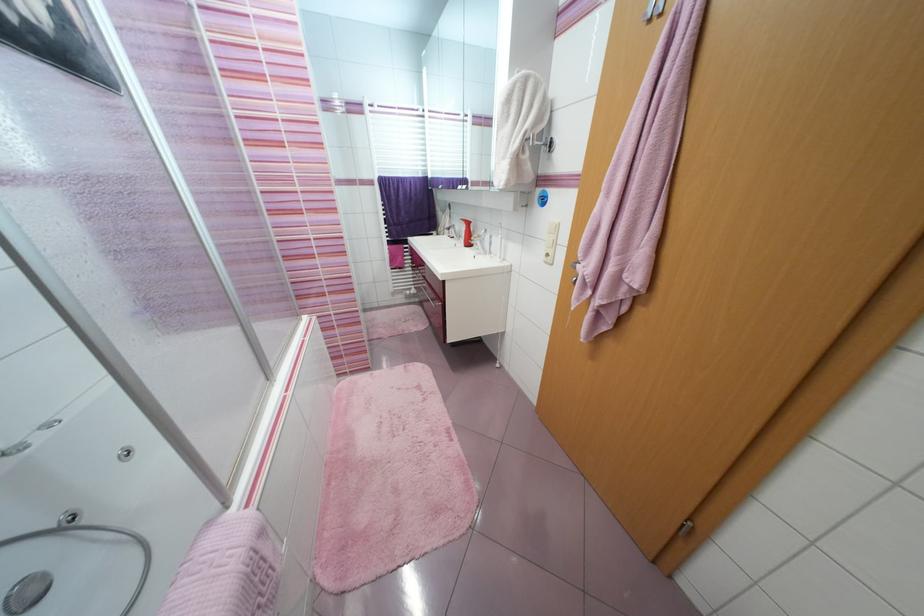
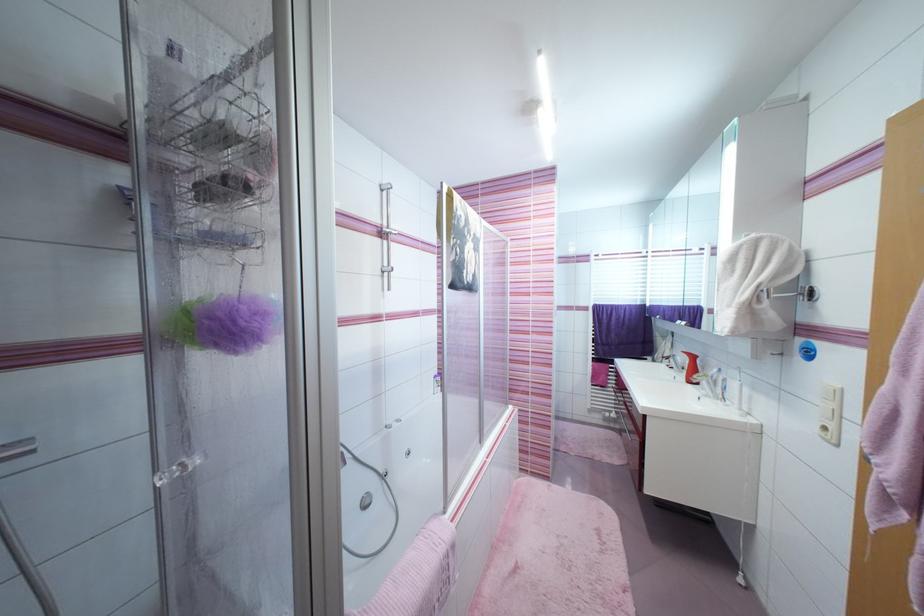
Find the pixel in the second image that matches point 582,301 in the first image.

(883, 517)